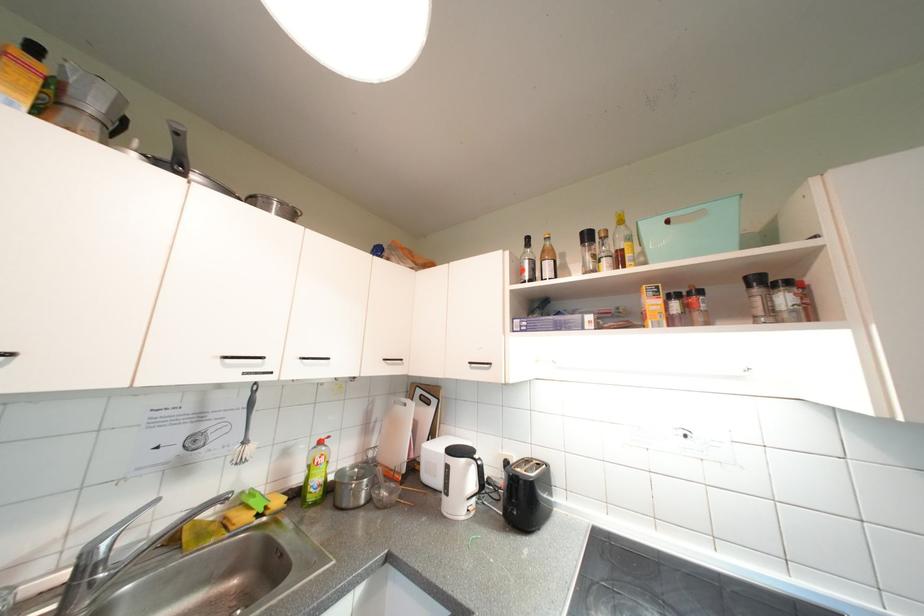
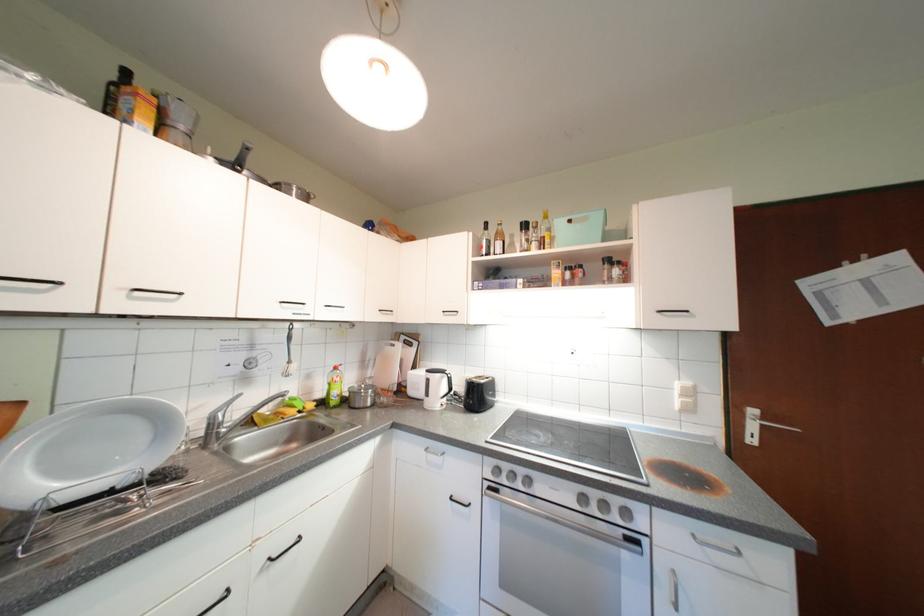
Locate, in the second image, the point that corresponds to pixel 797 285 in the first image.

(627, 265)